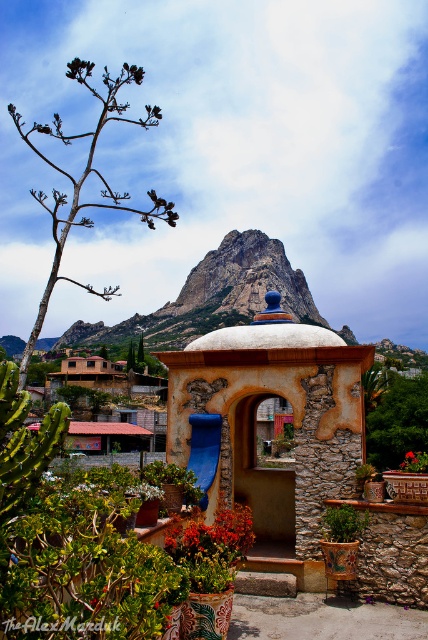
You are planning to place a new decorative statue in the scene. The statue requires a flat, elevated surface that is higher than the surrounding ground level. Which object between the terracotta stone gazebo at center and the brown wooden hut at center would be the best location for placing the statue?

The terracotta stone gazebo at center is positioned over the brown wooden hut at center, so placing the statue on the gazebo would provide a higher elevated surface compared to the hut.

You are planning to place a new bench in the scene. The bench requires 3 meters of space. Given the brown woody tree at left and the brown wooden hut at center, which object provides more space for the bench?

The brown woody tree at left has a greater width than the brown wooden hut at center, so placing the bench near the brown woody tree at left would provide more space for the bench.

You are planning to set up a picnic area and need to choose between the terracotta stone gazebo at center and the brown wooden hut at center. Which structure has a smaller width to accommodate more space for the picnic setup?

The terracotta stone gazebo at center has a smaller width than the brown wooden hut at center, making it a better choice for accommodating more space for the picnic setup.